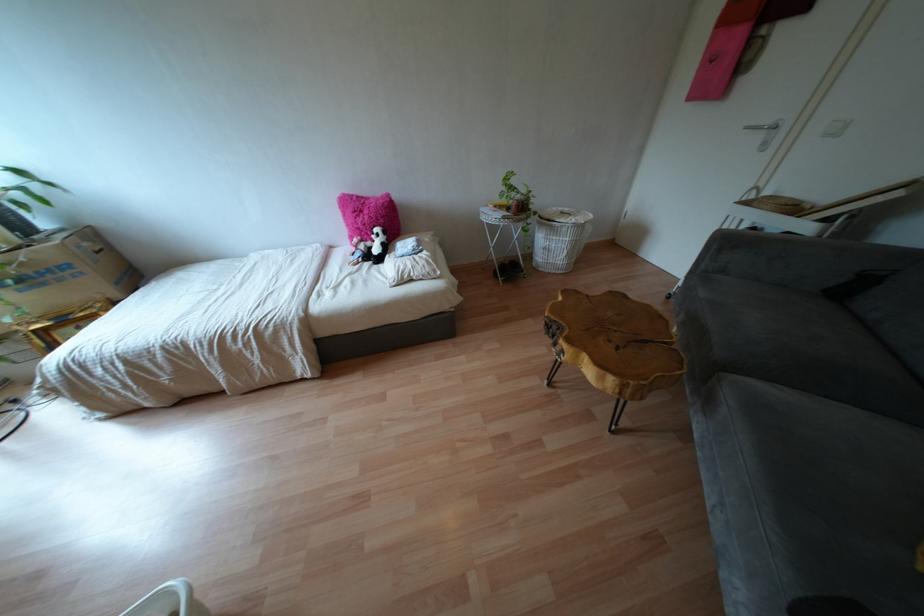
Find the location of `wicker tray`. wicker tray is located at coordinates (558, 238).